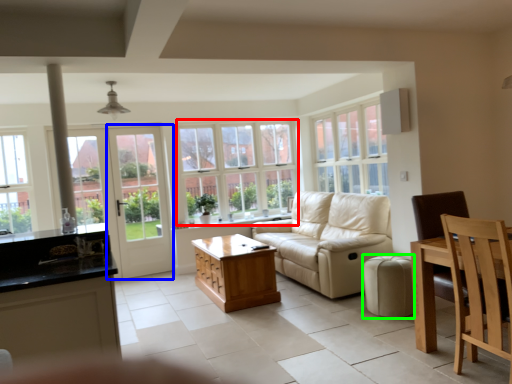
Question: Based on their relative distances, which object is farther from window (highlighted by a red box)? Choose from screen door (highlighted by a blue box) and stool (highlighted by a green box).

Choices:
 (A) screen door
 (B) stool

Answer: (B)